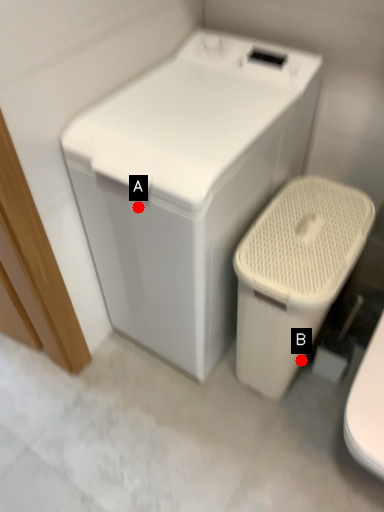
Question: Two points are circled on the image, labeled by A and B beside each circle. Which point appears farthest from the camera in this image?

Choices:
 (A) A is further
 (B) B is further

Answer: (B)